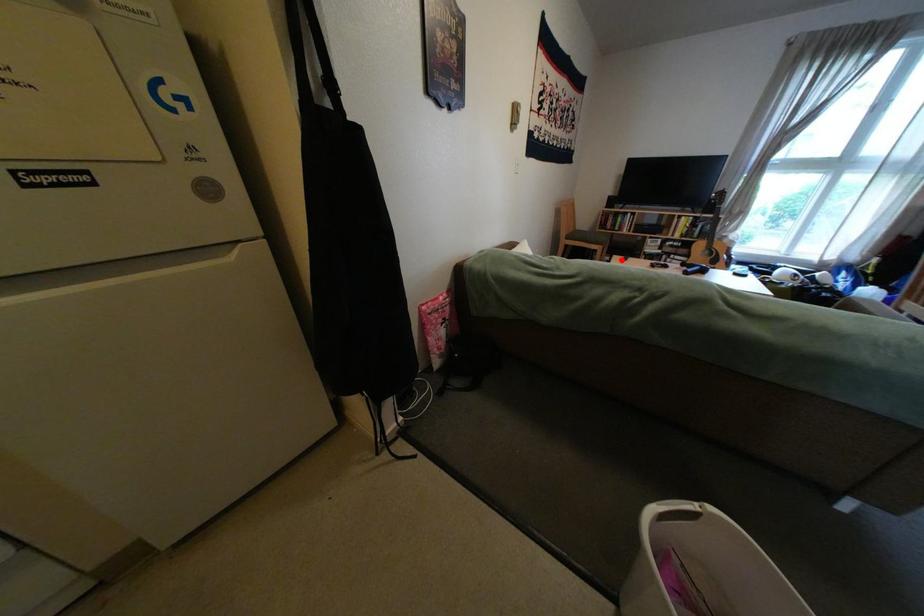
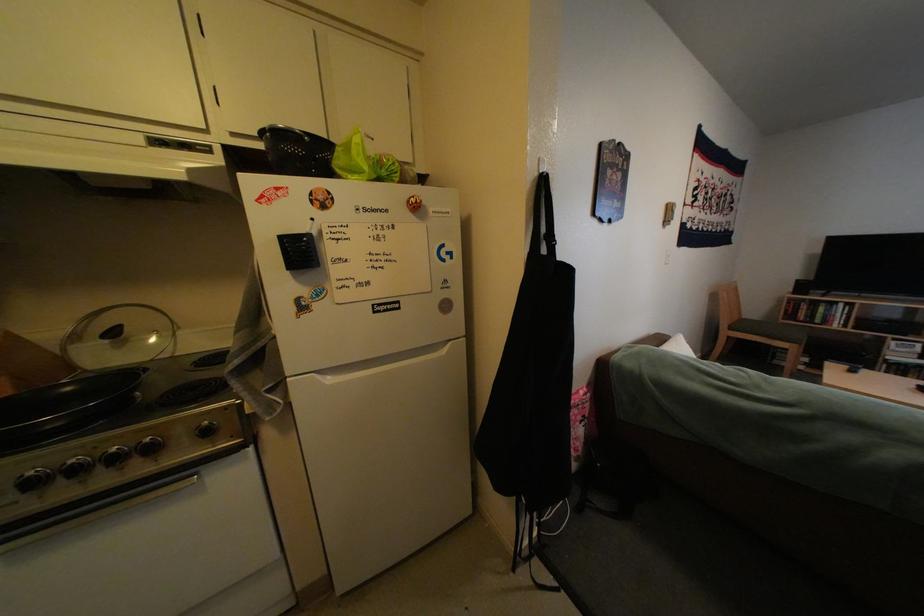
The point at the highlighted location is marked in the first image. Where is the corresponding point in the second image?

(820, 361)